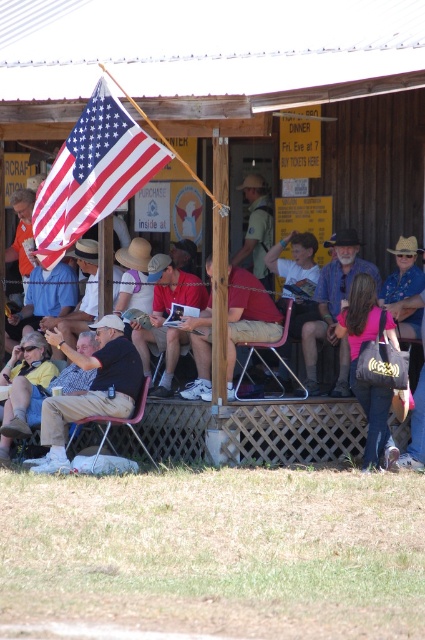
Question: Does pink fabric purse at lower right appear on the right side of brown straw cowboy hat at center?

Choices:
 (A) yes
 (B) no

Answer: (A)

Question: Considering the relative positions of wooden hut at center and matte black jacket at lower left in the image provided, where is wooden hut at center located with respect to matte black jacket at lower left?

Choices:
 (A) below
 (B) above

Answer: (B)

Question: In this image, where is wooden hut at center located relative to brown leather cowboy hat at upper right?

Choices:
 (A) right
 (B) left

Answer: (B)

Question: Which point is farther to the camera?

Choices:
 (A) (419, 250)
 (B) (232, 344)
 (C) (116, 397)
 (D) (353, 353)

Answer: (A)

Question: Among these objects, which one is nearest to the camera?

Choices:
 (A) pink fabric purse at lower right
 (B) brown leather cowboy hat at upper right

Answer: (A)

Question: Which object is positioned closest to the matte black jacket at lower left?

Choices:
 (A) plaid shirt at center
 (B) brown leather cowboy hat at upper right

Answer: (A)